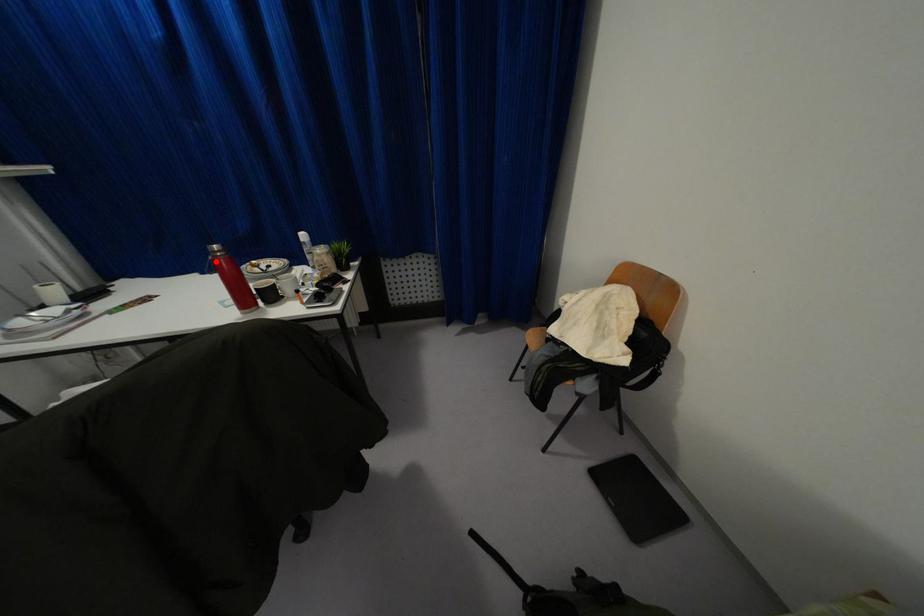
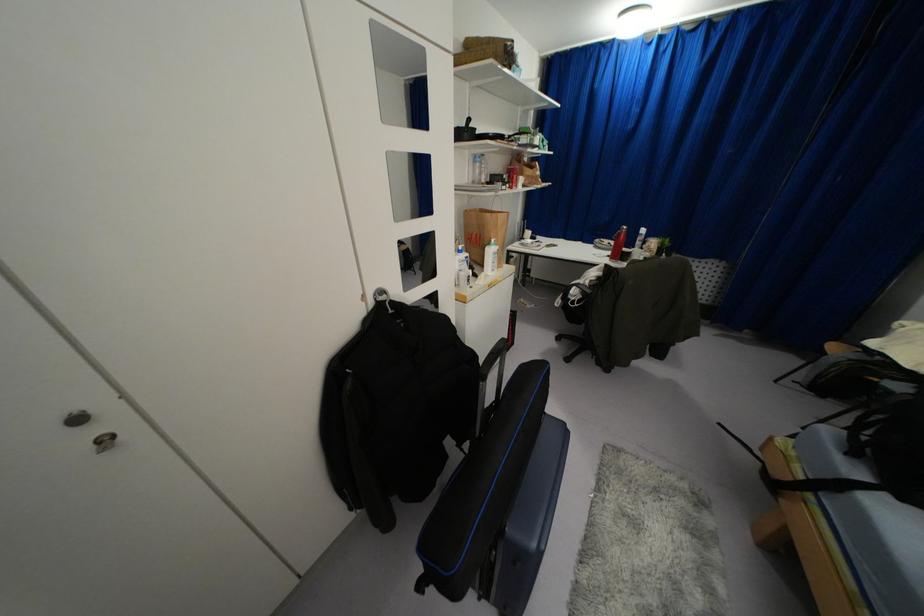
The point at the highlighted location is marked in the first image. Where is the corresponding point in the second image?

(618, 233)